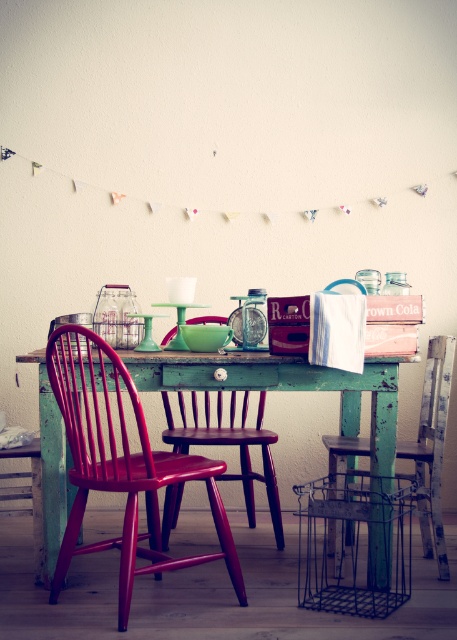
You are planning to place a new decorative item on the dining table. You have two options to choose from. One is the matte red chair at center and the other is the metallic wire basket at center. Which one requires more space on the table?

The matte red chair at center is larger in size than the metallic wire basket at center, so it requires more space on the table.

You are arranging flowers for a rustic event and need to place a bouquet that requires a tall container. Given the metallic wire basket at center and wooden chair at center in the scene, which object would be more suitable for holding the bouquet?

The wooden chair at center is taller than the metallic wire basket at center, making it a better choice for holding the bouquet that requires a tall container.